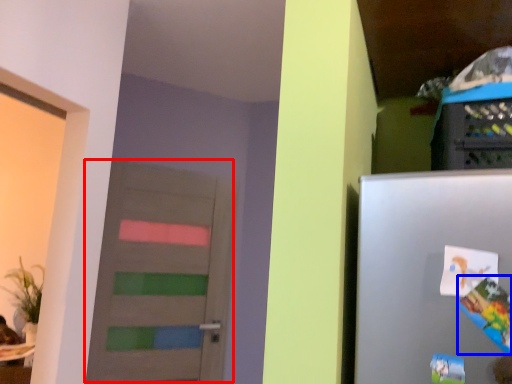
Question: Among these objects, which one is nearest to the camera, door (highlighted by a red box) or comic book (highlighted by a blue box)?

Choices:
 (A) door
 (B) comic book

Answer: (B)